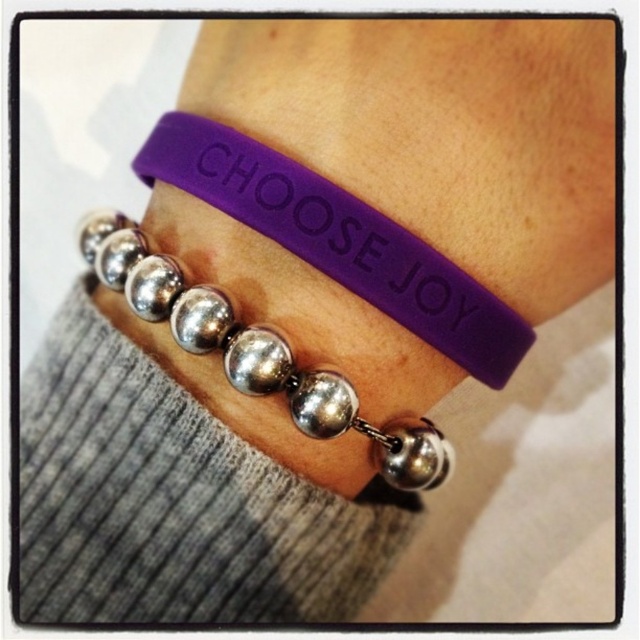
Based on the photo, you are a jeweler examining the bracelets on the wrist. Which bracelet is closer to your view, the purple rubber bracelet at upper center or the silver metallic bead at center?

The purple rubber bracelet at upper center is closer to your view because the silver metallic bead at center is behind it.

You are a photographer trying to focus on the bracelets on the wrist. You notice two points marked on the image. Which point, point (276, 214) or point (184, 294), is closer to your camera lens?

Point (276, 214) is closer to the camera lens than point (184, 294).